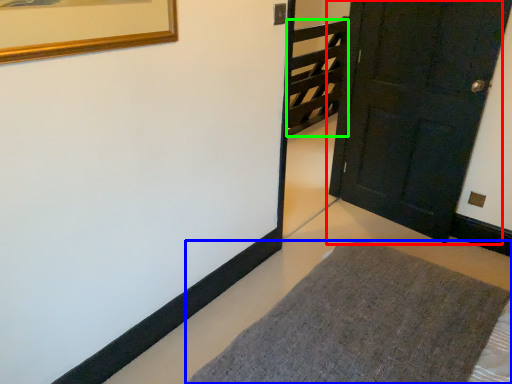
Question: Which object is positioned farthest from door (highlighted by a red box)? Select from furniture (highlighted by a blue box) and stairwell (highlighted by a green box).

Choices:
 (A) furniture
 (B) stairwell

Answer: (B)